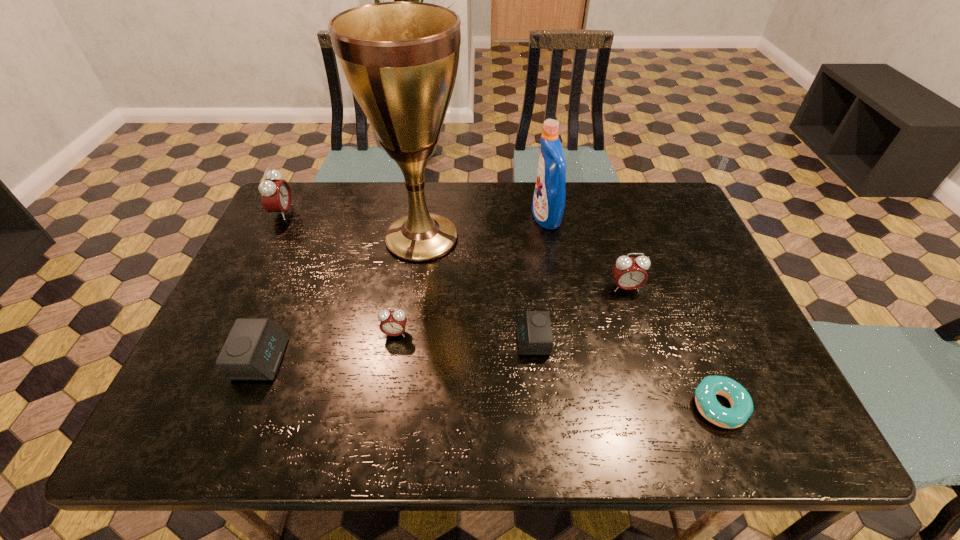
Identify the location of the tallest object. (400, 59).

Locate an element on the screen. Image resolution: width=960 pixels, height=540 pixels. brown trophy cup is located at coordinates (400, 59).

Identify the location of the seventh shortest object. (548, 204).

Locate an element on the screen. This screenshot has height=540, width=960. detergent is located at coordinates (548, 204).

Find the location of a particular element. The image size is (960, 540). the farthest pink alarm clock is located at coordinates (276, 196).

Locate an element on the screen. the tallest alarm clock is located at coordinates (276, 196).

Identify the location of the fourth nearest alarm clock. The image size is (960, 540). (629, 273).

You are a GUI agent. You are given a task and a screenshot of the screen. Output one action in this format:
    pyautogui.click(x=<x>, y=<y>)
    Task: Click on the rightmost pink alarm clock
    Image resolution: width=960 pixels, height=540 pixels.
    Given the screenshot: What is the action you would take?
    click(629, 273)

I want to click on the smallest pink alarm clock, so click(393, 323).

I want to click on the nearest pink alarm clock, so click(393, 323).